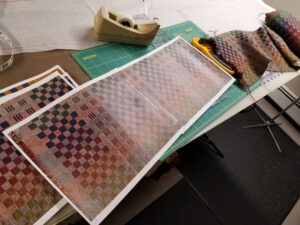
Locate an element on the screen. This screenshot has height=225, width=300. table is located at coordinates tap(28, 60).